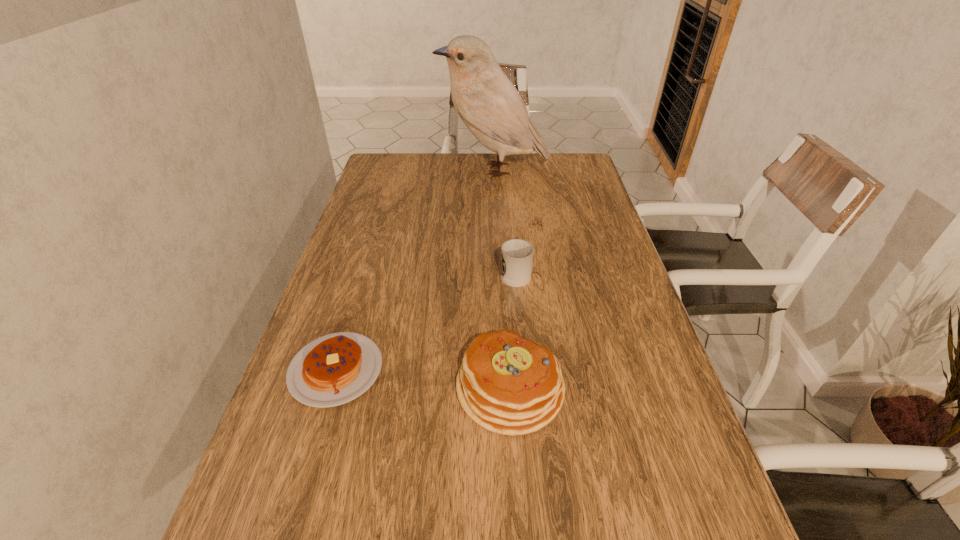
This screenshot has width=960, height=540. I want to click on vacant space that is in between the second shortest object and the right pancake, so click(x=513, y=330).

Find the location of a particular element. vacant space in between the third tallest object and the right pancake is located at coordinates (513, 330).

You are a GUI agent. You are given a task and a screenshot of the screen. Output one action in this format:
    pyautogui.click(x=<x>, y=<y>)
    Task: Click on the second closest object to the shorter pancake
    
    Given the screenshot: What is the action you would take?
    pyautogui.click(x=516, y=255)

Point out which object is positioned as the nearest to the taller pancake. Please provide its 2D coordinates. Your answer should be formatted as a tuple, i.e. [(x, y)], where the tuple contains the x and y coordinates of a point satisfying the conditions above.

[(334, 369)]

This screenshot has width=960, height=540. Identify the location of free space in the image that satisfies the following two spatial constraints: 1. on the face of the parakeet; 2. on the left side of the taller pancake. (506, 388).

Identify the location of vacant area that satisfies the following two spatial constraints: 1. on the face of the farthest object; 2. on the right side of the taller pancake. (506, 388).

Identify the location of vacant space that satisfies the following two spatial constraints: 1. on the front side of the shorter pancake; 2. on the left side of the right pancake. The height and width of the screenshot is (540, 960). (330, 388).

Identify the location of blank area in the image that satisfies the following two spatial constraints: 1. on the face of the parakeet; 2. on the side of the second shortest object where the handle is located. This screenshot has height=540, width=960. (499, 272).

I want to click on vacant area in the image that satisfies the following two spatial constraints: 1. on the face of the parakeet; 2. on the side of the third nearest object where the handle is located, so click(x=499, y=272).

I want to click on vacant area in the image that satisfies the following two spatial constraints: 1. on the face of the parakeet; 2. on the side of the cup where the handle is located, so click(499, 272).